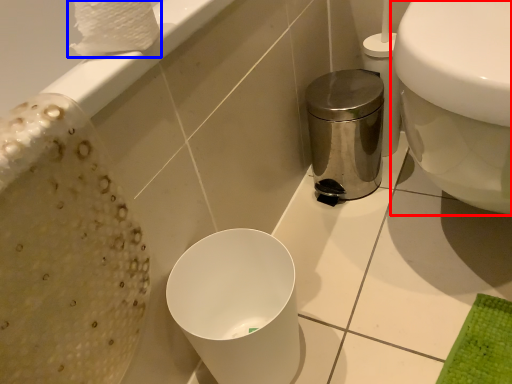
Question: Which of the following is the farthest to the observer, toilet (highlighted by a red box) or toilet paper (highlighted by a blue box)?

Choices:
 (A) toilet
 (B) toilet paper

Answer: (B)